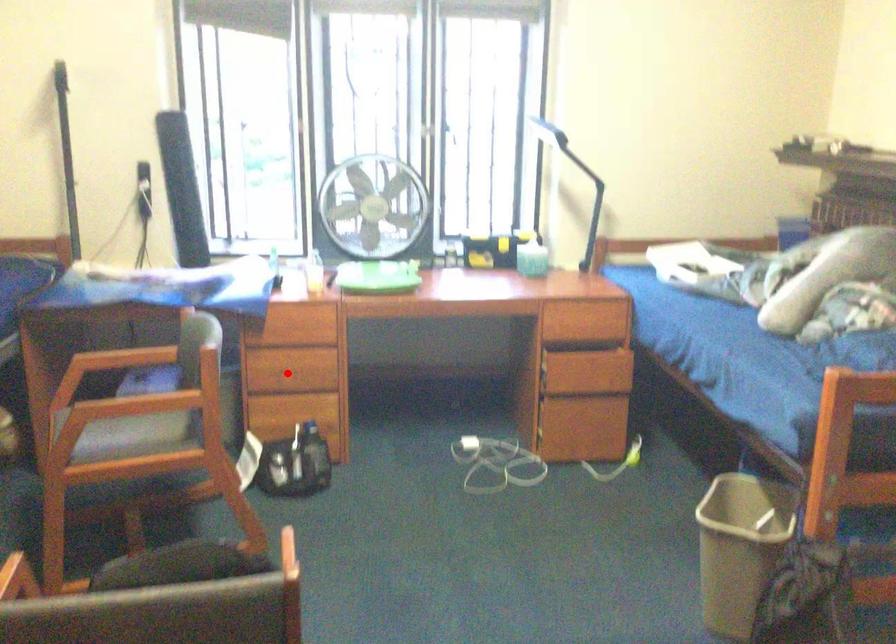
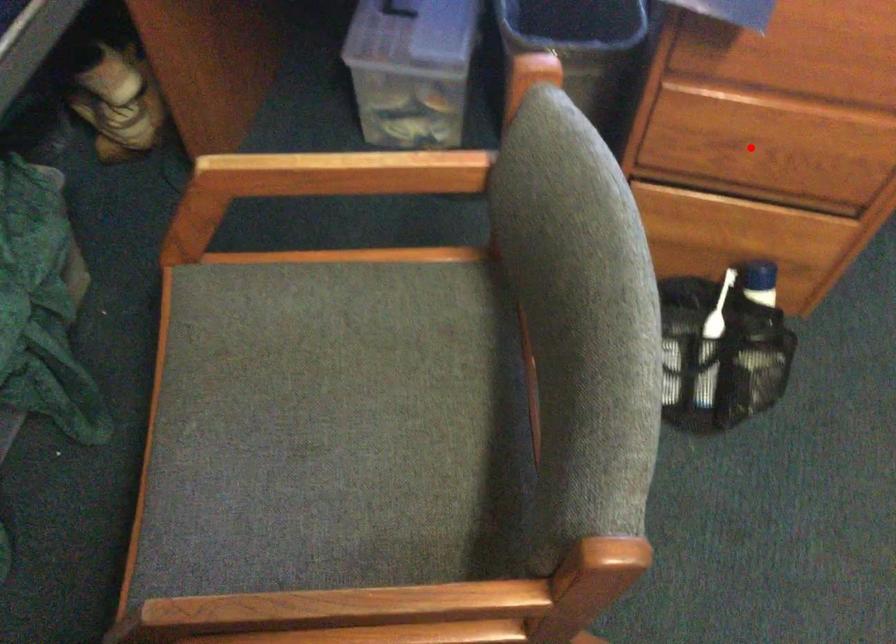
Looking at this image, I am providing you with two images of the same scene from different viewpoints. A red point is marked on the first image and another point is marked on the second image. Are the points marked in image1 and image2 representing the same 3D position?

Yes